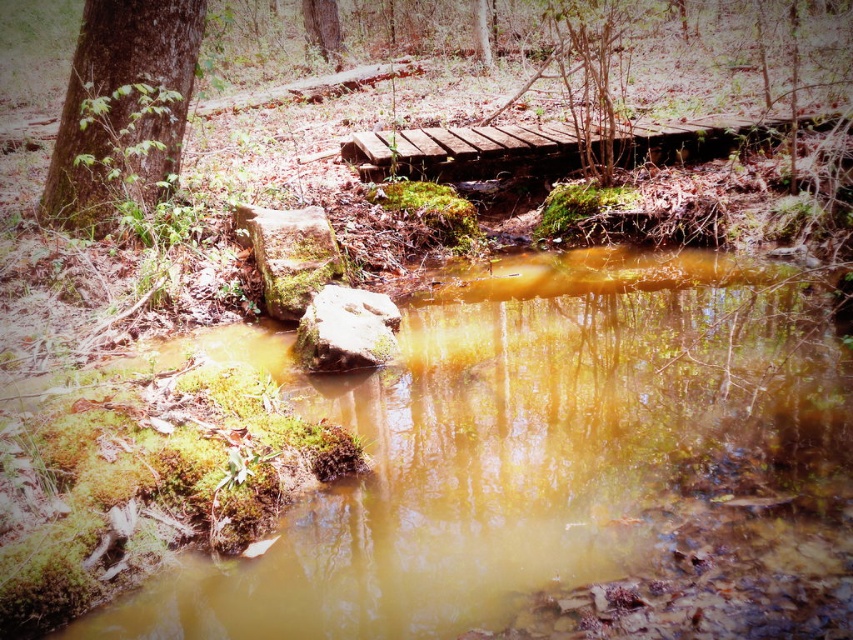
Does green mossy rock at center come in front of green mossy tree at upper center?

Yes.

In order to click on green mossy rock at center in this screenshot , I will do `click(346, 330)`.

Between rustic wooden bridge at center and green mossy rock at center-left, which one has more height?

With more height is green mossy rock at center-left.

Does rustic wooden bridge at center come in front of green mossy rock at center-left?

That is False.

You are a GUI agent. You are given a task and a screenshot of the screen. Output one action in this format:
    pyautogui.click(x=<x>, y=<y>)
    Task: Click on the rustic wooden bridge at center
    The height and width of the screenshot is (640, 853).
    Given the screenshot: What is the action you would take?
    point(459,150)

Is rustic wooden bridge at center thinner than green mossy rock at center?

Incorrect, rustic wooden bridge at center's width is not less than green mossy rock at center's.

Is the position of rustic wooden bridge at center more distant than that of green mossy rock at center?

Yes, rustic wooden bridge at center is behind green mossy rock at center.

Is point (369, 132) closer to camera compared to point (352, 294)?

No, (369, 132) is behind (352, 294).

Locate an element on the screen. The image size is (853, 640). rustic wooden bridge at center is located at coordinates (459, 150).